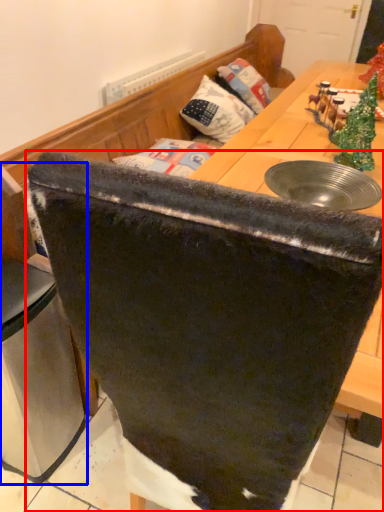
Question: Which of the following is the closest to the observer, chair (highlighted by a red box) or leftover (highlighted by a blue box)?

Choices:
 (A) chair
 (B) leftover

Answer: (A)